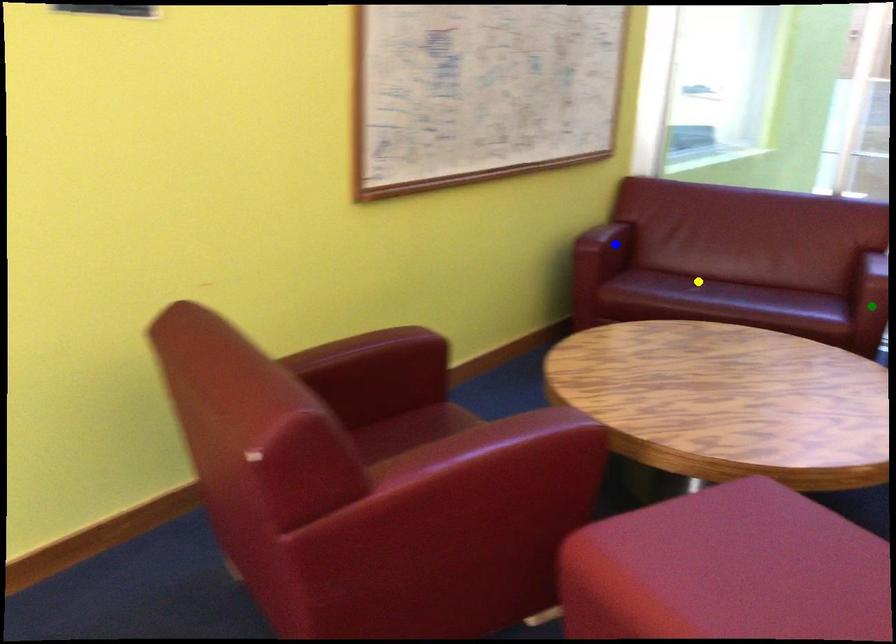
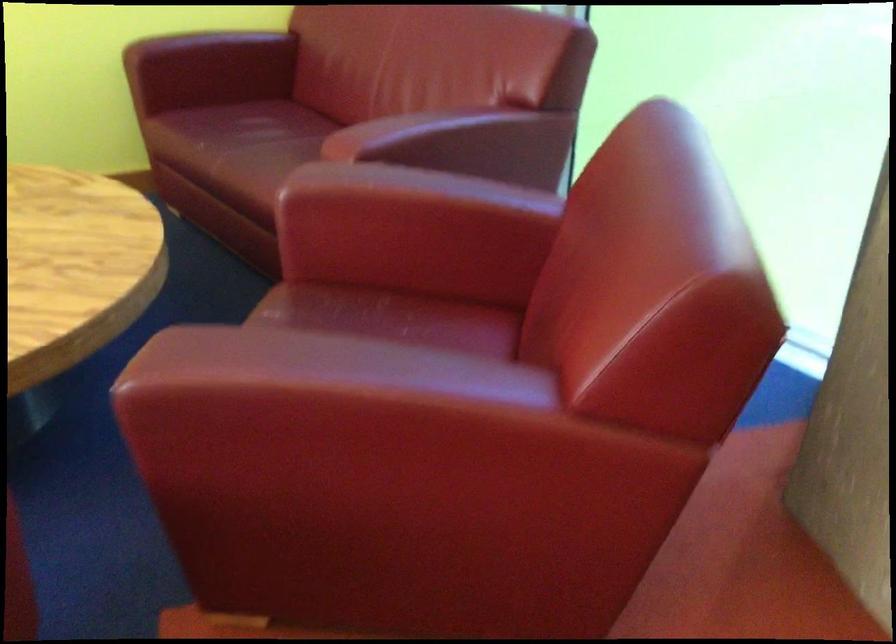
I am providing you with two images of the same scene from different viewpoints. Three points are marked in image1. Which point corresponds to a part or object that is occluded in image2?In image1, three points are marked. Which of them correspond to a part or object that is occluded in image2?Among the three points shown in image1, which one corresponds to a part or object that is no longer visible due to occlusion in image2?

Invisible in image2: green point.